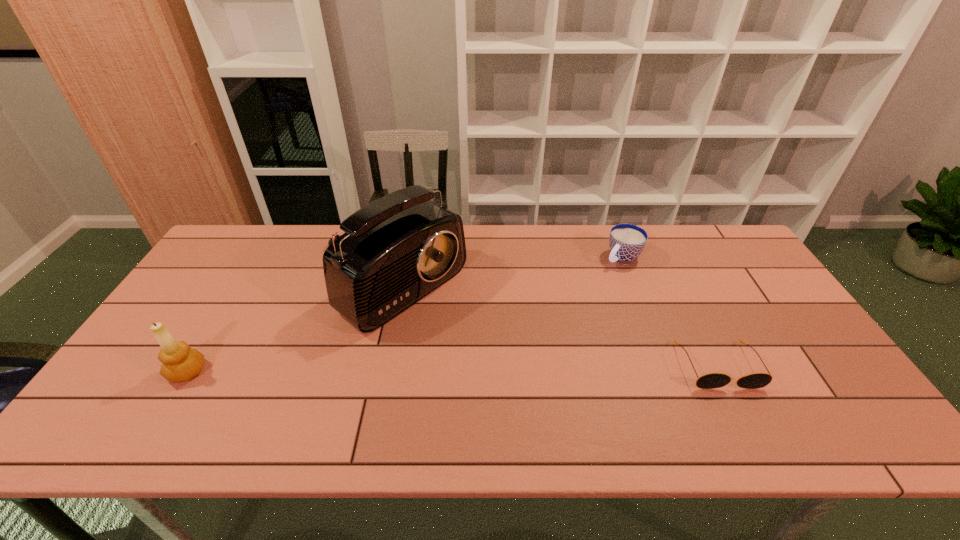
The width and height of the screenshot is (960, 540). I want to click on free region located on the front-facing side of the radio receiver, so click(483, 347).

Identify the location of free region located 0.370m on the front-facing side of the radio receiver. (552, 395).

This screenshot has height=540, width=960. I want to click on vacant space located 0.210m on the front-facing side of the radio receiver, so click(500, 360).

Where is `cup at the far edge`? The height and width of the screenshot is (540, 960). cup at the far edge is located at coordinates (627, 241).

Where is `radio receiver located at the far edge`? radio receiver located at the far edge is located at coordinates tap(397, 249).

Where is `candle_holder present at the near edge`? candle_holder present at the near edge is located at coordinates (180, 363).

Where is `sunglasses that is positioned at the near edge`? This screenshot has height=540, width=960. sunglasses that is positioned at the near edge is located at coordinates (711, 380).

Locate an element on the screen. object present at the left edge is located at coordinates (180, 363).

You are a GUI agent. You are given a task and a screenshot of the screen. Output one action in this format:
    pyautogui.click(x=<x>, y=<y>)
    Task: Click on the object present at the near left corner
    
    Given the screenshot: What is the action you would take?
    pyautogui.click(x=180, y=363)

The height and width of the screenshot is (540, 960). In the image, there is a desktop. What are the coordinates of `vacant area at the far edge` in the screenshot? It's located at (308, 245).